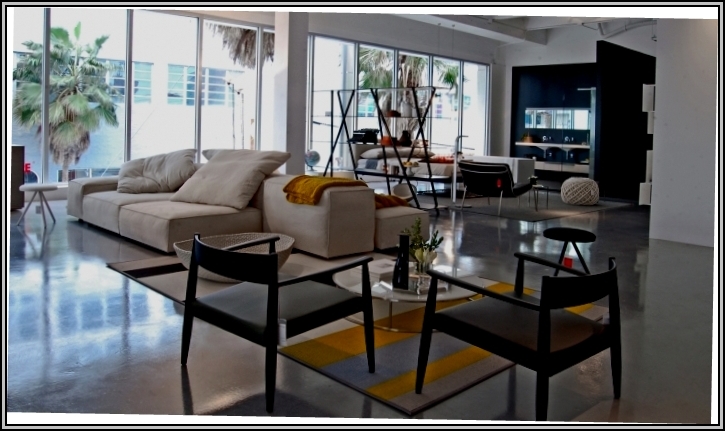
The width and height of the screenshot is (725, 431). What are the coordinates of `pillar` in the screenshot? It's located at (293, 84).